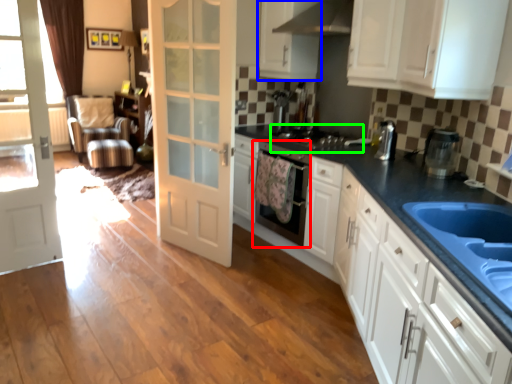
Question: Based on their relative distances, which object is farther from dish washer (highlighted by a red box)? Choose from cabinetry (highlighted by a blue box) and appliance (highlighted by a green box).

Choices:
 (A) cabinetry
 (B) appliance

Answer: (A)